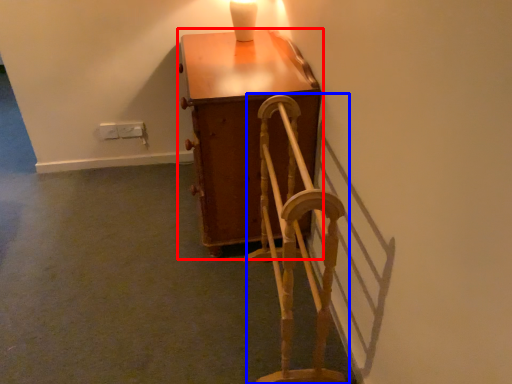
Question: Which of the following is the closest to the observer, furniture (highlighted by a red box) or rocking chair (highlighted by a blue box)?

Choices:
 (A) furniture
 (B) rocking chair

Answer: (B)